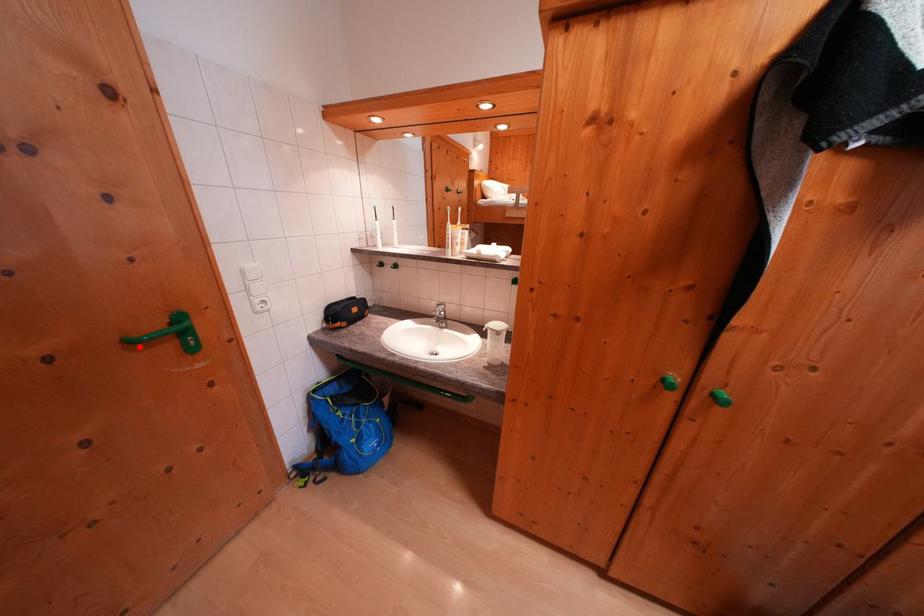
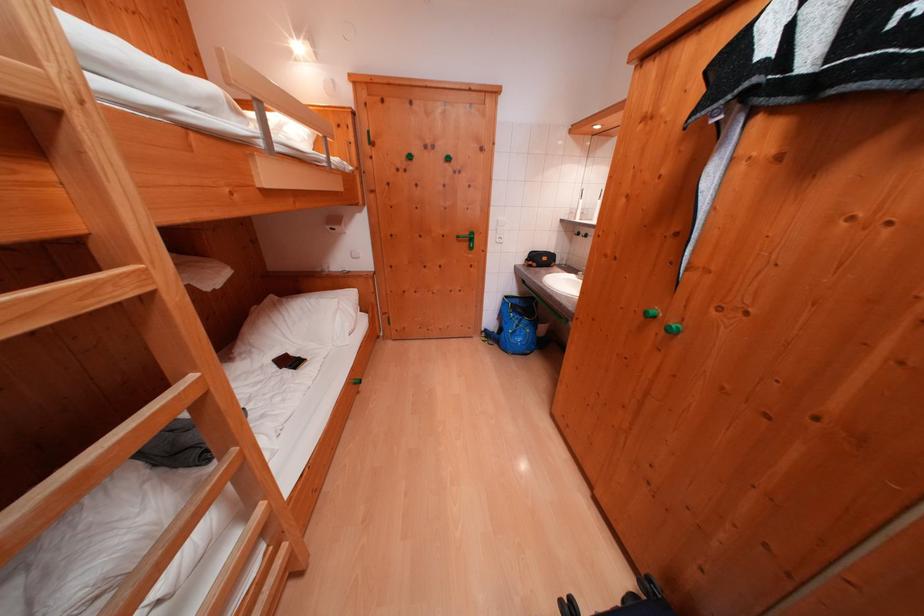
Question: I am providing you with two images of the same scene from different viewpoints. Image1 has a red point marked. In image2, the corresponding 3D location appears at what relative position? Reply with the corresponding letter.

Choices:
 (A) Closer
 (B) Farther

Answer: (A)